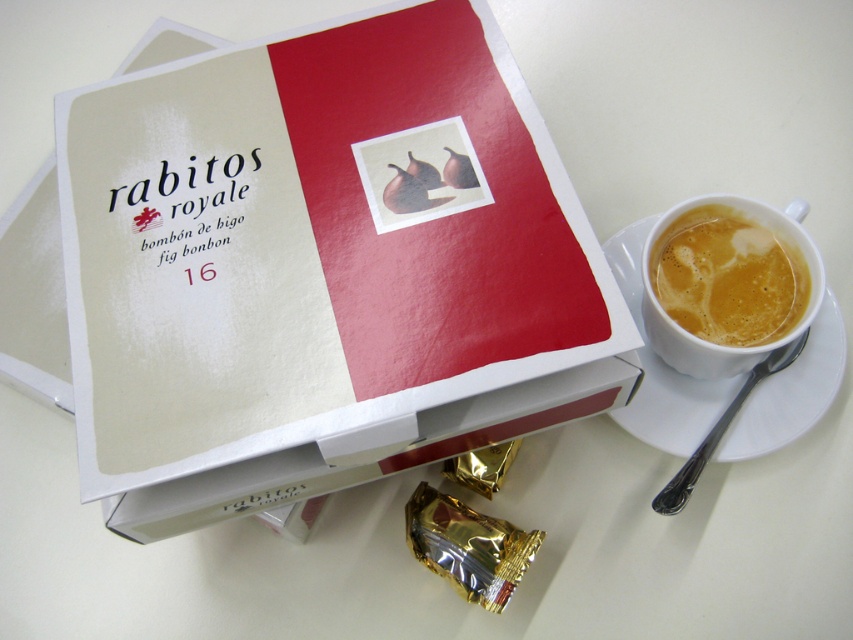
Question: Can you confirm if white paper book at upper center is positioned to the left of white frothy liquid at upper right?

Choices:
 (A) no
 (B) yes

Answer: (B)

Question: Can you confirm if white ceramic saucer at right is positioned to the left of white frothy liquid at upper right?

Choices:
 (A) no
 (B) yes

Answer: (B)

Question: Which point is closer to the camera taking this photo?

Choices:
 (A) (614, 260)
 (B) (691, 305)
 (C) (119, 234)

Answer: (C)

Question: Is white paper book at upper center below white ceramic saucer at right?

Choices:
 (A) no
 (B) yes

Answer: (A)

Question: Which object is farther from the camera taking this photo?

Choices:
 (A) white ceramic saucer at right
 (B) white paper book at upper center
 (C) white frothy liquid at upper right

Answer: (A)

Question: Which point is closer to the camera?

Choices:
 (A) (746, 253)
 (B) (825, 344)
 (C) (213, 269)

Answer: (C)